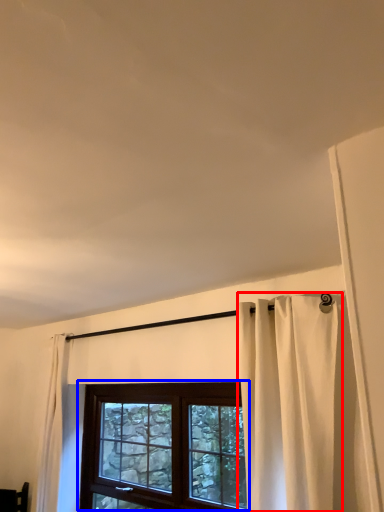
Question: Which of the following is the closest to the observer, curtain (highlighted by a red box) or window (highlighted by a blue box)?

Choices:
 (A) curtain
 (B) window

Answer: (A)